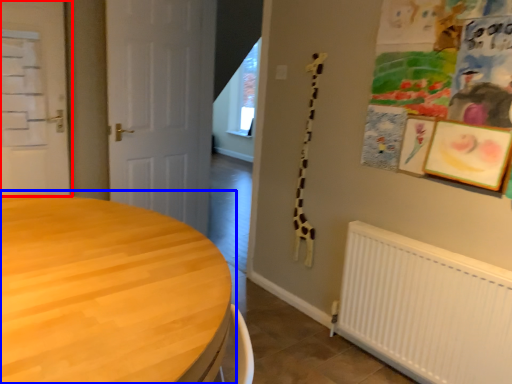
Question: Which object is further to the camera taking this photo, door (highlighted by a red box) or table (highlighted by a blue box)?

Choices:
 (A) door
 (B) table

Answer: (A)